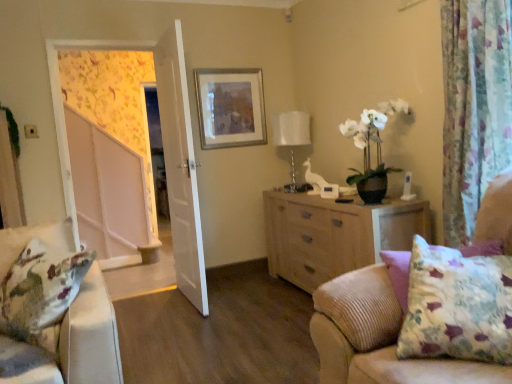
Question: From a real-world perspective, is silver metallic picture frame at upper center physically located above or below floral fabric curtain at right?

Choices:
 (A) below
 (B) above

Answer: (B)

Question: From the image's perspective, is silver metallic picture frame at upper center positioned above or below floral fabric curtain at right?

Choices:
 (A) below
 (B) above

Answer: (B)

Question: Which of these objects is positioned farthest from the light wood dresser at center?

Choices:
 (A) white glossy table lamp at upper center
 (B) fluffy beige couch at lower right
 (C) white glossy screen door at left
 (D) floral fabric curtain at right
 (E) white wooden door at center

Answer: (C)

Question: Which of these objects is positioned closest to the white wooden door at center?

Choices:
 (A) white glossy table lamp at upper center
 (B) silver metallic picture frame at upper center
 (C) light wood dresser at center
 (D) floral fabric curtain at right
 (E) fluffy beige couch at lower right

Answer: (B)